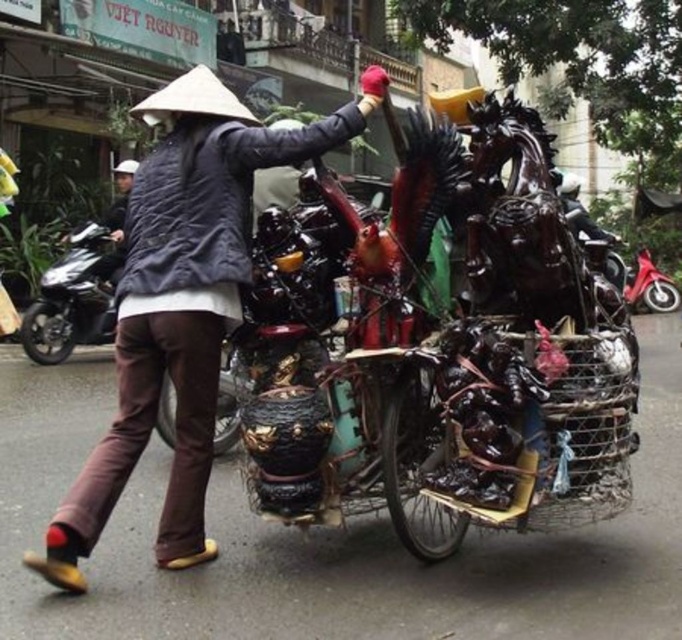
Is shiny black motorcycle at left taller than metallic red scooter at right?

Indeed, shiny black motorcycle at left has a greater height compared to metallic red scooter at right.

Is point (89, 268) positioned after point (647, 273)?

No, it is not.

Does point (113, 292) come closer to viewer compared to point (655, 296)?

That is True.

Where is `shiny black motorcycle at left`? The width and height of the screenshot is (682, 640). shiny black motorcycle at left is located at coordinates (74, 298).

Can you confirm if matte black vase at center is shorter than metallic red scooter at right?

No.

Identify the location of matte black vase at center. The image size is (682, 640). (181, 304).

Who is more forward, (83, 548) or (651, 291)?

Point (83, 548)

Locate an element on the screen. matte black vase at center is located at coordinates (181, 304).

Between point (235, 300) and point (117, 262), which one is positioned in front?

Point (235, 300)

Identify the location of matte black vase at center. This screenshot has height=640, width=682. (181, 304).

This screenshot has height=640, width=682. Find the location of `matte black vase at center`. matte black vase at center is located at coordinates (181, 304).